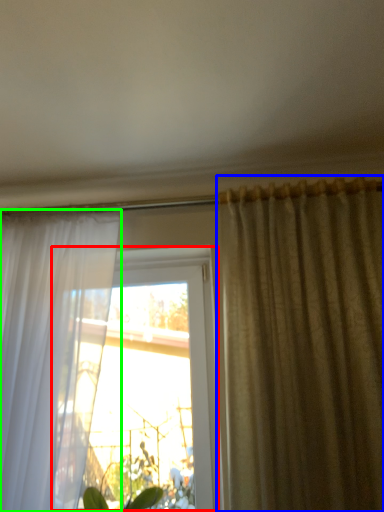
Question: Estimate the real-world distances between objects in this image. Which object is farther from window (highlighted by a red box), curtain (highlighted by a blue box) or curtain (highlighted by a green box)?

Choices:
 (A) curtain
 (B) curtain

Answer: (A)